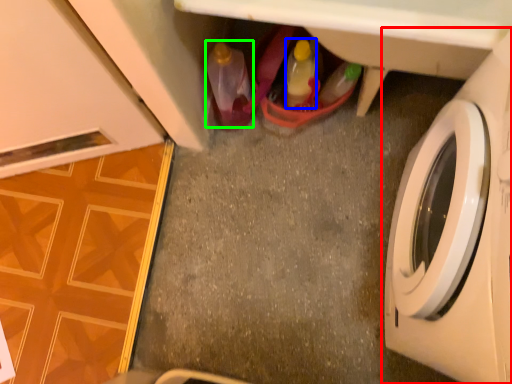
Question: Which object is positioned farthest from washing machine (highlighted by a red box)? Select from bottle (highlighted by a blue box) and bottle (highlighted by a green box).

Choices:
 (A) bottle
 (B) bottle

Answer: (B)